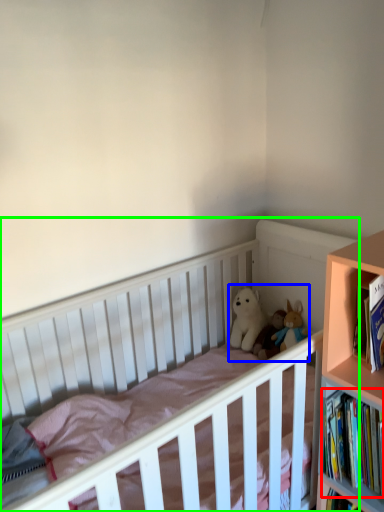
Question: Which is nearer to the book (highlighted by a red box)? toy (highlighted by a blue box) or infant bed (highlighted by a green box).

Choices:
 (A) toy
 (B) infant bed

Answer: (A)